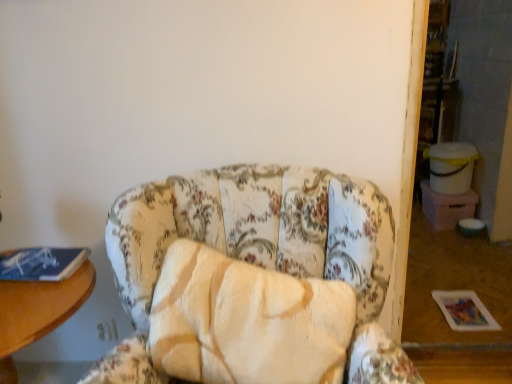
This screenshot has width=512, height=384. Describe the element at coordinates (42, 263) in the screenshot. I see `blue matte book at left` at that location.

What is the approximate width of blue matte book at left?

6.33 inches.

In order to click on wooden table at left in this screenshot , I will do tap(38, 311).

Is point (27, 306) positioned after point (280, 267)?

No, it is in front of (280, 267).

From a real-world perspective, which is physically above, wooden table at left or floral fabric chair at center?

floral fabric chair at center is physically above.

How different are the orientations of wooden table at left and floral fabric chair at center in degrees?

The angular difference between wooden table at left and floral fabric chair at center is 0.000262 degrees.

At what (x,y) coordinates should I click in order to perform the action: click on table below the floral fabric chair at center (from the image's perspective). Please return your answer as a coordinate pair (x, y). This screenshot has height=384, width=512. Looking at the image, I should click on [38, 311].

Does floral fabric chair at center have a larger size compared to blue matte book at left?

Correct, floral fabric chair at center is larger in size than blue matte book at left.

From a real-world perspective, which object stands above the other?

blue matte book at left is physically above.

From the picture: In the image, is floral fabric chair at center on the left side or the right side of blue matte book at left?

floral fabric chair at center is positioned on blue matte book at left's right side.

Is floral fabric chair at center placed right next to blue matte book at left?

floral fabric chair at center and blue matte book at left are clearly separated.

Does blue matte book at left have a larger size compared to floral fabric chair at center?

No, blue matte book at left is not bigger than floral fabric chair at center.

From the image's perspective, is blue matte book at left below floral fabric chair at center?

No.

Can you confirm if blue matte book at left is positioned to the right of floral fabric chair at center?

In fact, blue matte book at left is to the left of floral fabric chair at center.

Considering the positions of point (65, 251) and point (357, 372), is point (65, 251) closer or farther from the camera than point (357, 372)?

Point (65, 251) is farther from the camera than point (357, 372).

Looking at this image, how different are the orientations of blue matte book at left and wooden table at left in degrees?

There is a 4.6-degree angle between the facing directions of blue matte book at left and wooden table at left.

How far apart are blue matte book at left and wooden table at left?

The distance of blue matte book at left from wooden table at left is 4.01 inches.

Which object is further away from the camera taking this photo, blue matte book at left or wooden table at left?

blue matte book at left.

Does blue matte book at left touch wooden table at left?

No, blue matte book at left is not making contact with wooden table at left.

Would you consider wooden table at left to be distant from blue matte book at left?

That's not correct — wooden table at left is a little close to blue matte book at left.

From a real-world perspective, which object rests below the other?

wooden table at left is physically lower.

In the scene shown: Considering the positions of objects wooden table at left and blue matte book at left in the image provided, who is in front, wooden table at left or blue matte book at left?

wooden table at left.

Which of these two, wooden table at left or blue matte book at left, stands taller?

wooden table at left is taller.

Is floral fabric chair at center closer to the viewer compared to wooden table at left?

Yes, it is.

From the image's perspective, is floral fabric chair at center under wooden table at left?

No, from the image's perspective, floral fabric chair at center is not beneath wooden table at left.

Which is behind, point (313, 231) or point (24, 339)?

The point (313, 231) is more distant.

The width and height of the screenshot is (512, 384). Identify the location of chair that appears on the right of wooden table at left. (253, 279).

This screenshot has width=512, height=384. What are the coordinates of `book above the floral fabric chair at center (from a real-world perspective)` in the screenshot? It's located at (42, 263).

Looking at the image, which one is located further to floral fabric chair at center, blue matte book at left or wooden table at left?

blue matte book at left is positioned further to the anchor floral fabric chair at center.

Considering their positions, is floral fabric chair at center positioned closer to blue matte book at left than wooden table at left?

wooden table at left is positioned closer to the anchor blue matte book at left.

Looking at the image, which one is located closer to wooden table at left, blue matte book at left or floral fabric chair at center?

blue matte book at left is positioned closer to the anchor wooden table at left.

When comparing their distances from blue matte book at left, does wooden table at left or floral fabric chair at center seem closer?

Among the two, wooden table at left is located nearer to blue matte book at left.

From the image, which object appears to be nearer to floral fabric chair at center, wooden table at left or blue matte book at left?

wooden table at left is closer to floral fabric chair at center.

From the image, which object appears to be nearer to wooden table at left, floral fabric chair at center or blue matte book at left?

blue matte book at left lies closer to wooden table at left than the other object.

Locate an element on the screen. The width and height of the screenshot is (512, 384). book situated between wooden table at left and floral fabric chair at center from left to right is located at coordinates (42, 263).